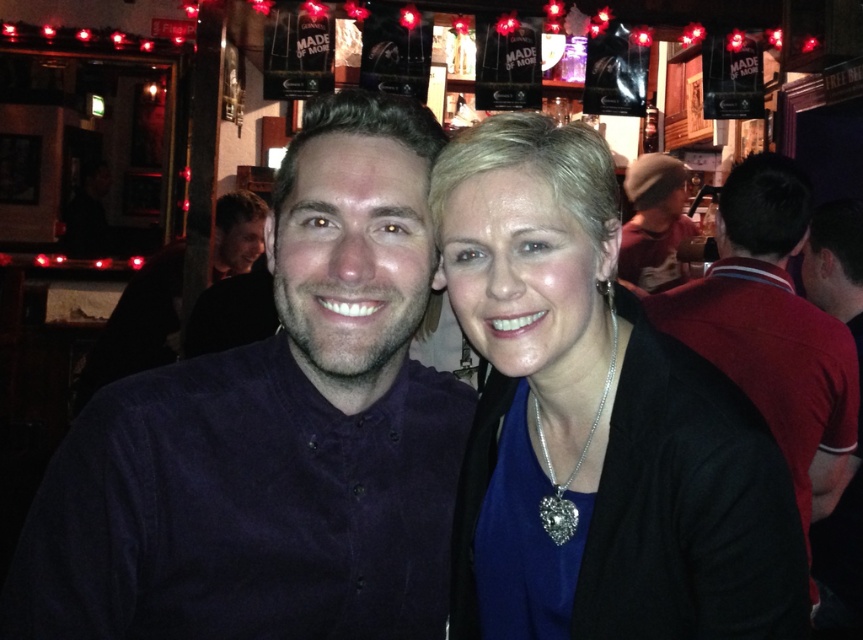
You are a photographer trying to capture a group photo of two people wearing the dark blue corduroy shirt at center and the matte black sweater at center. The minimum distance required for your camera to focus properly is 9 inches. Based on the scene, will the camera be able to focus on both subjects clearly?

The distance between the dark blue corduroy shirt at center and the matte black sweater at center is 8.76 inches, which is less than the camera minimum focusing distance of 9 inches. Therefore, the camera may not be able to focus on both subjects clearly.

You are taking a photo of two people in a bar. You notice two points in the image at coordinates point (397, 564) and point (721, 333). Which point is nearer to the camera?

Point (397, 564) is closer to the camera than point (721, 333).

From the picture: You are a photographer setting up for a group photo in this bar. You notice the dark blue corduroy shirt at center and the matte black sweater at center. Which clothing item is positioned higher on the person, making it more visible in the photo?

The dark blue corduroy shirt at center is much taller as matte black sweater at center, so it is positioned higher and more visible in the photo.